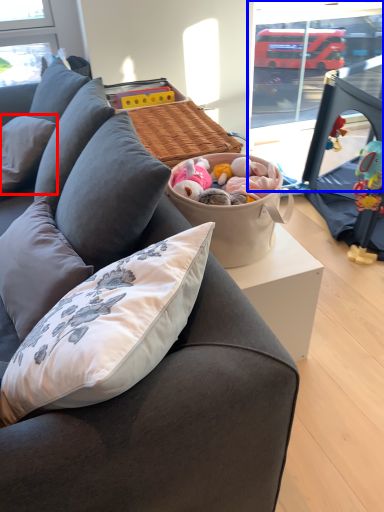
Question: Which object is further to the camera taking this photo, pillow (highlighted by a red box) or window screen (highlighted by a blue box)?

Choices:
 (A) pillow
 (B) window screen

Answer: (A)